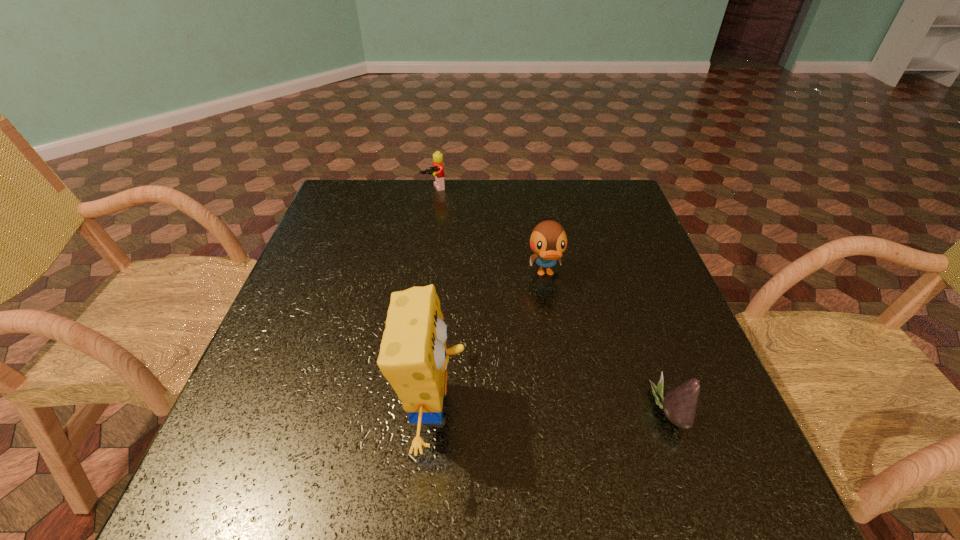
The width and height of the screenshot is (960, 540). In the image, there is a desktop. Identify the location of vacant space at the left edge. (295, 304).

Find the location of a particular element. The width and height of the screenshot is (960, 540). vacant space at the right edge is located at coordinates (607, 290).

In order to click on vacant area at the far left corner of the desktop in this screenshot , I will do `click(345, 186)`.

This screenshot has width=960, height=540. In the image, there is a desktop. Identify the location of vacant space at the near right corner. (686, 443).

Identify the location of empty space that is in between the rightmost object and the sponge. The width and height of the screenshot is (960, 540). (552, 410).

The width and height of the screenshot is (960, 540). What are the coordinates of `vacant area that lies between the tallest object and the duck` in the screenshot? It's located at (490, 341).

The height and width of the screenshot is (540, 960). In order to click on empty space that is in between the tallest object and the second farthest object in this screenshot , I will do `click(490, 341)`.

Where is `empty space between the tallest object and the third shortest object`? This screenshot has width=960, height=540. empty space between the tallest object and the third shortest object is located at coordinates (490, 341).

You are a GUI agent. You are given a task and a screenshot of the screen. Output one action in this format:
    pyautogui.click(x=<x>, y=<y>)
    Task: Click on the free spot between the tallest object and the rightmost object
    The width and height of the screenshot is (960, 540).
    Given the screenshot: What is the action you would take?
    pyautogui.click(x=552, y=410)

Find the location of a particular element. free space between the third nearest object and the tallest object is located at coordinates (490, 341).